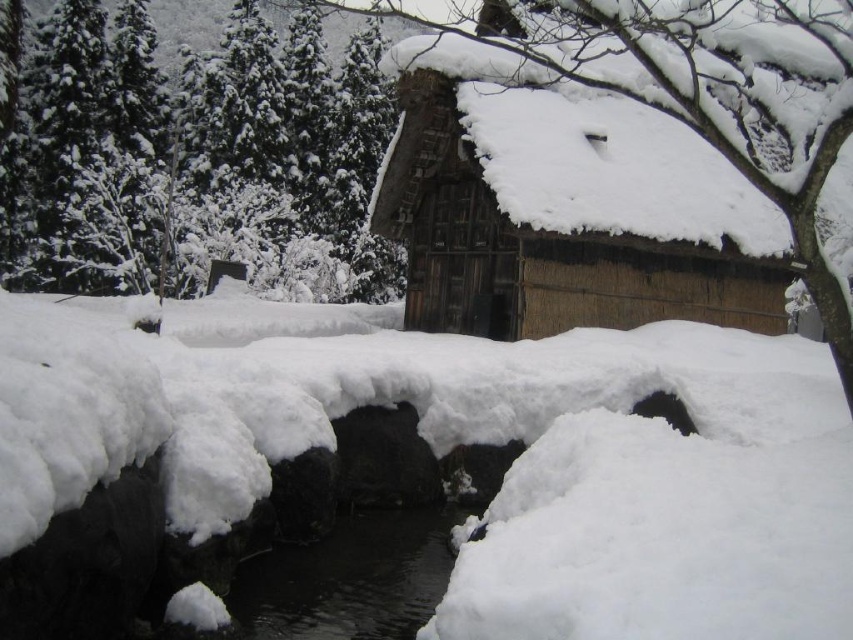
Does snow-covered evergreen at upper left appear on the right side of thatched wood cabin at center?

Incorrect, snow-covered evergreen at upper left is not on the right side of thatched wood cabin at center.

Does point (202, 67) come farther from viewer compared to point (422, 156)?

Yes, it is behind point (422, 156).

Does point (125, 289) lie in front of point (461, 109)?

No, it is behind (461, 109).

Where is `snow-covered evergreen at upper left`? The height and width of the screenshot is (640, 853). snow-covered evergreen at upper left is located at coordinates (196, 157).

Who is lower down, thatched wood cabin at center or black smooth water at center?

black smooth water at center is lower down.

Can you confirm if thatched wood cabin at center is positioned below black smooth water at center?

Incorrect, thatched wood cabin at center is not positioned below black smooth water at center.

Does point (657, 129) come behind point (409, 544)?

Yes, it is.

The image size is (853, 640). I want to click on thatched wood cabin at center, so click(541, 246).

Who is taller, snow-covered evergreen at upper left or black smooth water at center?

Standing taller between the two is snow-covered evergreen at upper left.

Who is positioned more to the left, snow-covered evergreen at upper left or black smooth water at center?

snow-covered evergreen at upper left is more to the left.

Who is more forward, (x=218, y=81) or (x=294, y=550)?

Point (x=294, y=550)

Locate an element on the screen. Image resolution: width=853 pixels, height=640 pixels. snow-covered evergreen at upper left is located at coordinates (196, 157).